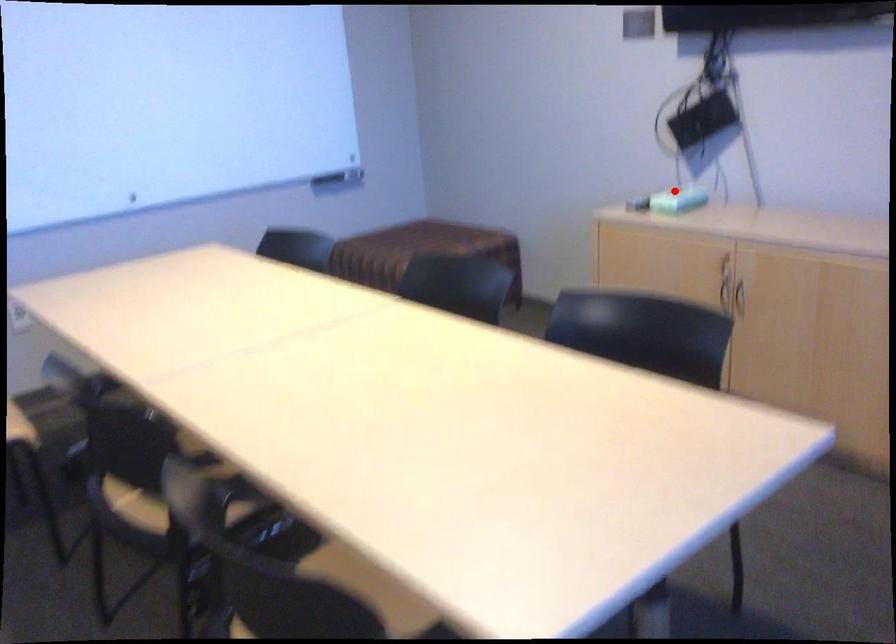
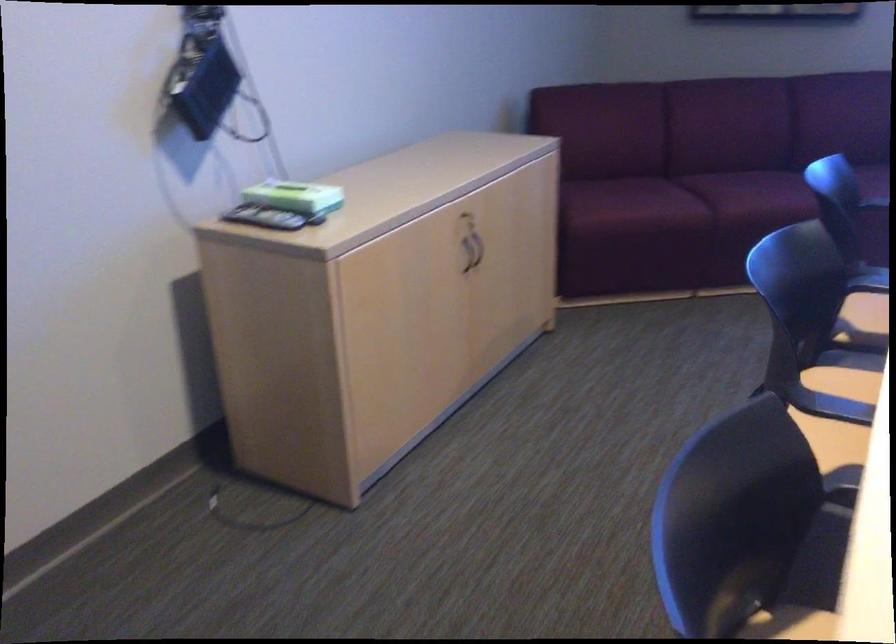
Question: A red point is marked in image1. In image2, is the corresponding 3D point closer to the camera or farther? Reply with the corresponding letter.

Choices:
 (A) The corresponding 3D point is closer.
 (B) The corresponding 3D point is farther.

Answer: (A)